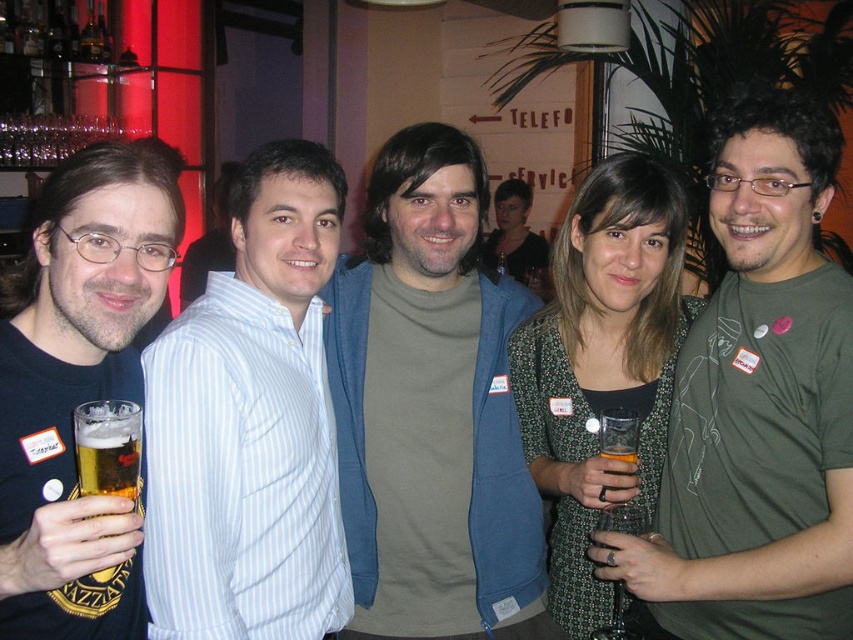
In the scene shown: You are standing in the bar and want to reach both the point at coordinates (746, 593) and the point at coordinates (299, 272). Which point should you approach first to be closer to the viewer?

Point at coordinates (746, 593) is closer to the viewer than point at coordinates (299, 272), so you should approach point at coordinates (746, 593) first.

You are standing in the bar and want to hand a drink to the person wearing the green matte shirt at center. Considering your arm length is 2.5 feet, can you reach them without moving closer?

The distance between you and the green matte shirt at center is 3.97 feet, which is greater than your arm length of 2.5 feet. Therefore, you cannot reach them without moving closer.